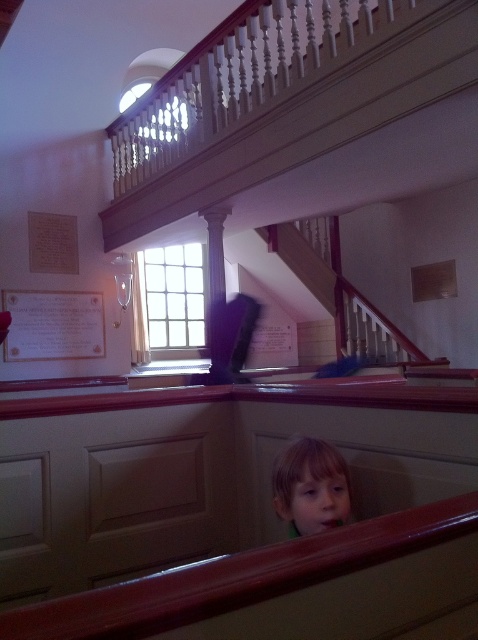
You are standing at the entrance of the building and want to reach the dome structure visible at the top of the landing. The white wooden staircase at upper center is your only path. Can you determine if the staircase leads directly to the dome structure?

The white wooden staircase at upper center is located at point (339, 291), which is the direct path to the dome structure at the top of the landing. Therefore, the staircase does lead directly to the dome structure.

You are an architect designing a new building and want to ensure there is enough space between the white wooden staircase at upper center and the white paper at upper left for safety regulations. According to the building code, the minimum required distance is 8 feet. Is the current distance compliant?

The distance between the white wooden staircase at upper center and the white paper at upper left is 8.94 feet, which exceeds the minimum requirement of 8 feet. Therefore, the current distance is compliant with safety regulations.

You are an interior designer assessing the space. You notice the white paper at upper left and the light brown hair at center. Which object is positioned higher in the image?

The white paper at upper left is positioned higher in the image than the light brown hair at center.